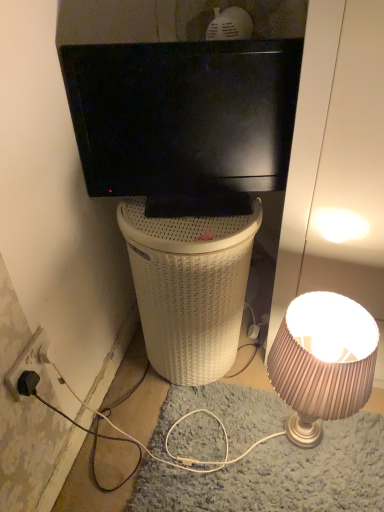
What do you see at coordinates (323, 362) in the screenshot? Image resolution: width=384 pixels, height=512 pixels. I see `shiny beige lampshade at right` at bounding box center [323, 362].

Measure the distance between point (372, 347) and camera.

Point (372, 347) is 1.01 meters from camera.

Identify the location of white wicker trash bin/can at center. The height and width of the screenshot is (512, 384). (189, 288).

This screenshot has height=512, width=384. What do you see at coordinates (189, 288) in the screenshot?
I see `white wicker trash bin/can at center` at bounding box center [189, 288].

The image size is (384, 512). I want to click on black plastic power outlet at lower left, so click(x=28, y=361).

Looking at this image, is shiny beige lampshade at right facing away from black plastic power outlet at lower left?

No, shiny beige lampshade at right is not facing the opposite direction of black plastic power outlet at lower left.

Is shiny beige lampshade at right wider or thinner than black plastic power outlet at lower left?

shiny beige lampshade at right is wider than black plastic power outlet at lower left.

Does shiny beige lampshade at right come behind black plastic power outlet at lower left?

No, shiny beige lampshade at right is closer to the viewer.

Is shiny beige lampshade at right placed right next to black plastic power outlet at lower left?

shiny beige lampshade at right and black plastic power outlet at lower left are not in contact.

Between black plastic power outlet at lower left and black glossy television at upper center, which one is positioned in front?

black plastic power outlet at lower left is more forward.

Which point is more forward, (x=34, y=368) or (x=81, y=109)?

The point (x=34, y=368) is in front.

In the scene shown: Who is taller, black plastic power outlet at lower left or black glossy television at upper center?

Standing taller between the two is black glossy television at upper center.

Is black plastic power outlet at lower left taller than shiny beige lampshade at right?

In fact, black plastic power outlet at lower left may be shorter than shiny beige lampshade at right.

Can you confirm if black plastic power outlet at lower left is thinner than shiny beige lampshade at right?

Correct, the width of black plastic power outlet at lower left is less than that of shiny beige lampshade at right.

From the image's perspective, is black plastic power outlet at lower left under shiny beige lampshade at right?

No.

Is black glossy television at upper center oriented away from black plastic power outlet at lower left?

No.

How many degrees apart are the facing directions of black glossy television at upper center and black plastic power outlet at lower left?

The angular difference between black glossy television at upper center and black plastic power outlet at lower left is 73.5 degrees.

From the image's perspective, which is below, black glossy television at upper center or black plastic power outlet at lower left?

black plastic power outlet at lower left is shown below in the image.

Is black glossy television at upper center taller than black plastic power outlet at lower left?

Indeed, black glossy television at upper center has a greater height compared to black plastic power outlet at lower left.

From the image's perspective, who appears lower, white wicker trash bin/can at center or shiny beige lampshade at right?

shiny beige lampshade at right.

Is white wicker trash bin/can at center facing towards shiny beige lampshade at right?

No, white wicker trash bin/can at center is not aimed at shiny beige lampshade at right.

From a real-world perspective, is white wicker trash bin/can at center located higher than shiny beige lampshade at right?

Yes.

Is white wicker trash bin/can at center at the back of shiny beige lampshade at right?

No, white wicker trash bin/can at center is not at the back of shiny beige lampshade at right.

Is the surface of shiny beige lampshade at right in direct contact with white wicker trash bin/can at center?

No, shiny beige lampshade at right is not making contact with white wicker trash bin/can at center.

Is point (325, 415) less distant than point (227, 230)?

Yes.

Find the location of a particular element. Image resolution: width=384 pixels, height=512 pixels. television on the left of shiny beige lampshade at right is located at coordinates (184, 121).

From the image's perspective, who appears lower, black glossy television at upper center or shiny beige lampshade at right?

shiny beige lampshade at right appears lower in the image.

Consider the image. Which is in front, black glossy television at upper center or shiny beige lampshade at right?

shiny beige lampshade at right is more forward.

This screenshot has width=384, height=512. Find the location of `power outlet lying above the shiny beige lampshade at right (from the image's perspective)`. power outlet lying above the shiny beige lampshade at right (from the image's perspective) is located at coordinates (28, 361).

In the image, there is a black glossy television at upper center. Where is `power outlet below it (from a real-world perspective)`? power outlet below it (from a real-world perspective) is located at coordinates (28, 361).

From the image, which object appears to be farther from white wicker trash bin/can at center, shiny beige lampshade at right or black glossy television at upper center?

shiny beige lampshade at right is further to white wicker trash bin/can at center.

Based on their spatial positions, is white wicker trash bin/can at center or shiny beige lampshade at right closer to black plastic power outlet at lower left?

white wicker trash bin/can at center lies closer to black plastic power outlet at lower left than the other object.

From the image, which object appears to be farther from black glossy television at upper center, black plastic power outlet at lower left or white wicker trash bin/can at center?

black plastic power outlet at lower left is positioned further to the anchor black glossy television at upper center.

Looking at the image, which one is located further to white wicker trash bin/can at center, black glossy television at upper center or black plastic power outlet at lower left?

black plastic power outlet at lower left lies further to white wicker trash bin/can at center than the other object.

From the picture: When comparing their distances from white wicker trash bin/can at center, does shiny beige lampshade at right or black plastic power outlet at lower left seem closer?

shiny beige lampshade at right is positioned closer to the anchor white wicker trash bin/can at center.

When comparing their distances from black plastic power outlet at lower left, does shiny beige lampshade at right or black glossy television at upper center seem closer?

Among the two, black glossy television at upper center is located nearer to black plastic power outlet at lower left.

Estimate the real-world distances between objects in this image. Which object is closer to shiny beige lampshade at right, white wicker trash bin/can at center or black plastic power outlet at lower left?

white wicker trash bin/can at center.

In the scene shown: Looking at the image, which one is located further to white wicker trash bin/can at center, black plastic power outlet at lower left or shiny beige lampshade at right?

black plastic power outlet at lower left is positioned further to the anchor white wicker trash bin/can at center.

You are a GUI agent. You are given a task and a screenshot of the screen. Output one action in this format:
    pyautogui.click(x=<x>, y=<y>)
    Task: Click on the trash bin/can that lies between black glossy television at upper center and shiny beige lampshade at right from top to bottom
    This screenshot has height=512, width=384.
    Given the screenshot: What is the action you would take?
    pyautogui.click(x=189, y=288)

Identify the location of trash bin/can between black plastic power outlet at lower left and shiny beige lampshade at right. The width and height of the screenshot is (384, 512). (189, 288).

You are a GUI agent. You are given a task and a screenshot of the screen. Output one action in this format:
    pyautogui.click(x=<x>, y=<y>)
    Task: Click on the trash bin/can between black glossy television at upper center and black plastic power outlet at lower left from top to bottom
    The height and width of the screenshot is (512, 384).
    Given the screenshot: What is the action you would take?
    pyautogui.click(x=189, y=288)

Identify the location of power outlet that lies between black glossy television at upper center and shiny beige lampshade at right from top to bottom. (28, 361).